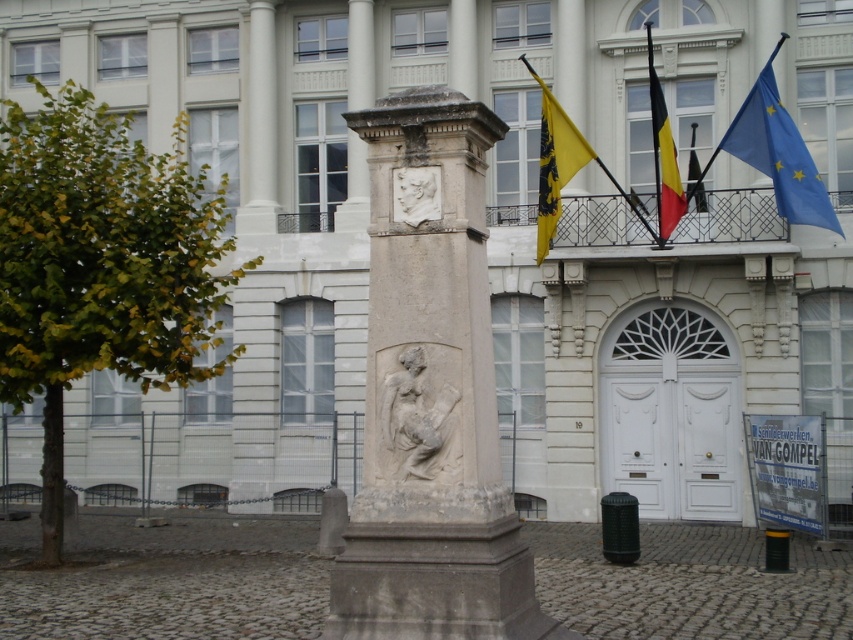
From the picture: Does beige stone relief at center have a greater width compared to blue fabric flag at upper right?

Incorrect, beige stone relief at center's width does not surpass blue fabric flag at upper right's.

Is point (416, 426) more distant than point (741, 138)?

No, (416, 426) is closer to viewer.

Between point (399, 448) and point (793, 177), which one is positioned in front?

Positioned in front is point (399, 448).

I want to click on beige stone relief at center, so click(416, 416).

Describe the element at coordinates (431, 403) in the screenshot. The width and height of the screenshot is (853, 640). I see `gray stone column at center` at that location.

This screenshot has height=640, width=853. What do you see at coordinates (431, 403) in the screenshot?
I see `gray stone column at center` at bounding box center [431, 403].

This screenshot has height=640, width=853. I want to click on gray stone column at center, so click(x=431, y=403).

Which is behind, point (418, 572) or point (561, 177)?

The point (561, 177) is more distant.

In the scene shown: Is gray stone column at center positioned at the back of yellow fabric flagpole at upper center?

No.

Image resolution: width=853 pixels, height=640 pixels. Identify the location of gray stone column at center. (431, 403).